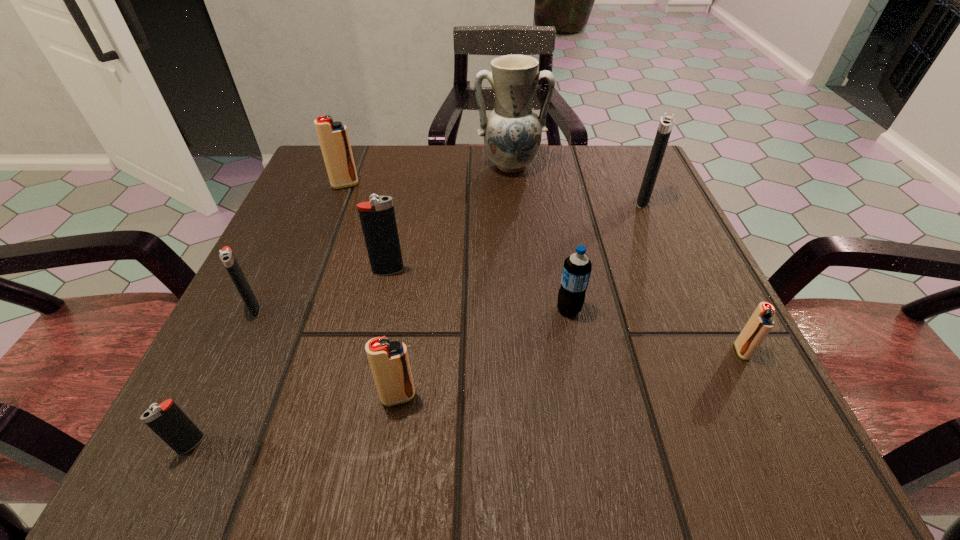
Where is `vacant space positioned 0.150m on the left of the soda bottle`? This screenshot has width=960, height=540. vacant space positioned 0.150m on the left of the soda bottle is located at coordinates (458, 309).

The image size is (960, 540). Find the location of `blank area located on the front of the fourth nearest igniter`. blank area located on the front of the fourth nearest igniter is located at coordinates (231, 356).

Where is `free location located on the back of the sixth farthest igniter`? free location located on the back of the sixth farthest igniter is located at coordinates (417, 271).

You are a GUI agent. You are given a task and a screenshot of the screen. Output one action in this format:
    pyautogui.click(x=<x>, y=<y>)
    Task: Click on the vacant space positioned on the back of the fifth farthest igniter
    Image resolution: width=960 pixels, height=540 pixels.
    Given the screenshot: What is the action you would take?
    pyautogui.click(x=723, y=315)

You are a GUI agent. You are given a task and a screenshot of the screen. Output one action in this format:
    pyautogui.click(x=<x>, y=<y>)
    Task: Click on the free region located 0.100m on the back of the nearest black igniter
    
    Given the screenshot: What is the action you would take?
    (x=229, y=364)

Where is `pottery located in the far edge section of the desktop`? The height and width of the screenshot is (540, 960). pottery located in the far edge section of the desktop is located at coordinates (512, 132).

The image size is (960, 540). Identify the location of object at the far left corner. (333, 137).

This screenshot has height=540, width=960. I want to click on object that is at the near left corner, so click(167, 420).

At what (x,y) coordinates should I click in order to perform the action: click on object positioned at the far right corner. Please return your answer as a coordinate pair (x, y). Image resolution: width=960 pixels, height=540 pixels. Looking at the image, I should click on (667, 121).

Where is `vacant point at the far edge`? vacant point at the far edge is located at coordinates (472, 187).